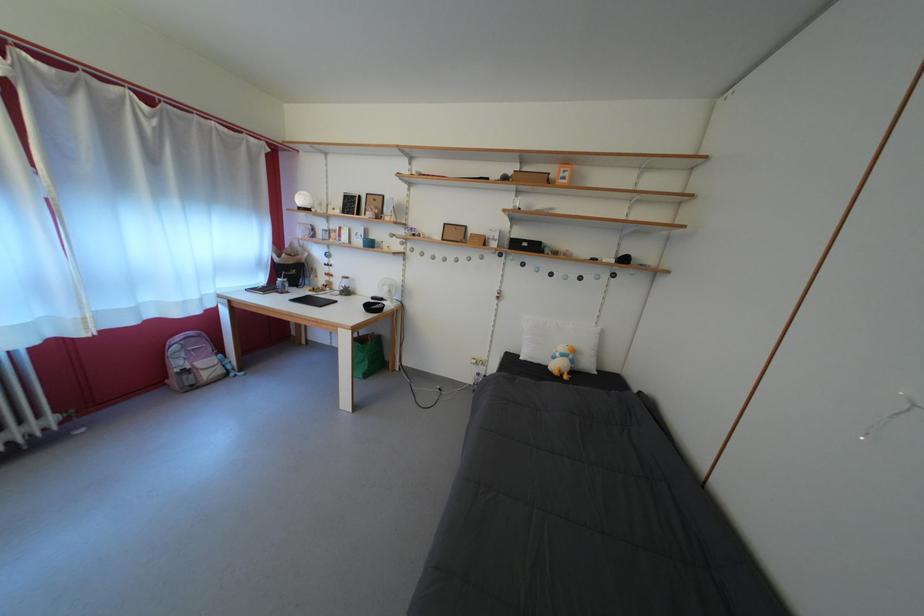
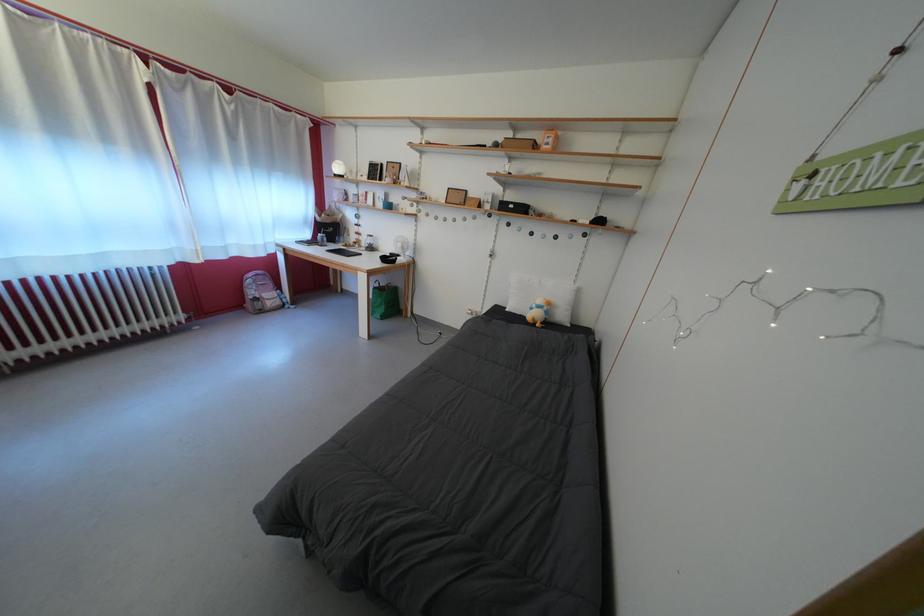
Where in the second image is the point corresponding to pixel 533 251 from the first image?

(519, 213)